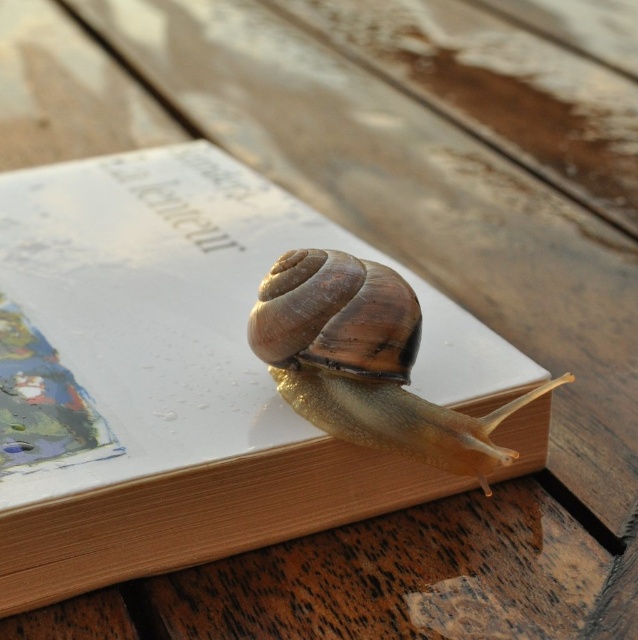
Who is higher up, white paper book at center or shiny brown shell at center?

white paper book at center is higher up.

Is white paper book at center smaller than shiny brown shell at center?

Actually, white paper book at center might be larger than shiny brown shell at center.

Which is behind, point (103, 186) or point (491, 461)?

Point (103, 186)

The image size is (638, 640). I want to click on white paper book at center, so click(179, 376).